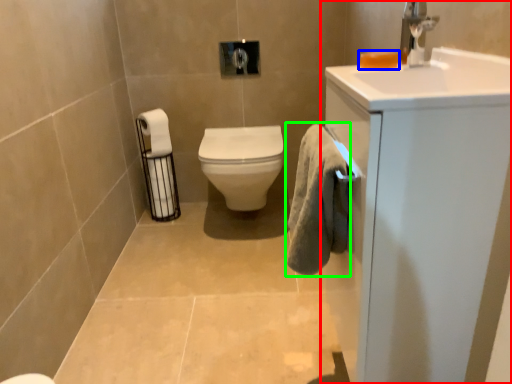
Question: Which is nearer to the bathroom cabinet (highlighted by a red box)? soap (highlighted by a blue box) or bath towel (highlighted by a green box).

Choices:
 (A) soap
 (B) bath towel

Answer: (B)